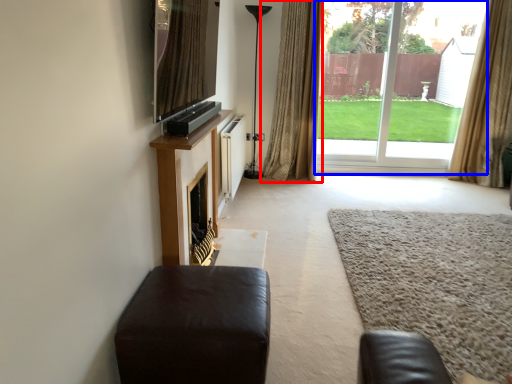
Question: Among these objects, which one is farthest to the camera, curtain (highlighted by a red box) or window frame (highlighted by a blue box)?

Choices:
 (A) curtain
 (B) window frame

Answer: (B)